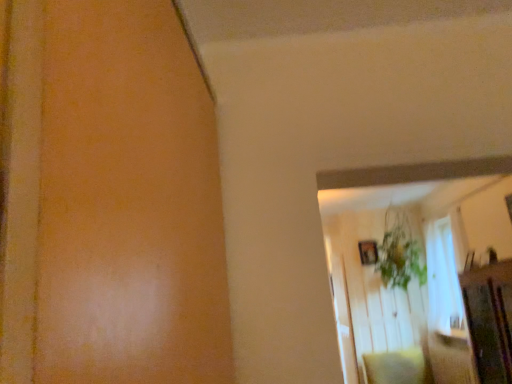
Question: Is soft beige pillow at lower right smaller than green leafy plant at upper center?

Choices:
 (A) no
 (B) yes

Answer: (B)

Question: From the image's perspective, is soft beige pillow at lower right located beneath green leafy plant at upper center?

Choices:
 (A) yes
 (B) no

Answer: (A)

Question: Is soft beige pillow at lower right to the left of green leafy plant at upper center from the viewer's perspective?

Choices:
 (A) no
 (B) yes

Answer: (B)

Question: From a real-world perspective, does soft beige pillow at lower right stand above green leafy plant at upper center?

Choices:
 (A) yes
 (B) no

Answer: (B)

Question: Does soft beige pillow at lower right lie behind green leafy plant at upper center?

Choices:
 (A) yes
 (B) no

Answer: (B)

Question: Considering the relative positions of soft beige pillow at lower right and green leafy plant at upper center in the image provided, is soft beige pillow at lower right to the right of green leafy plant at upper center from the viewer's perspective?

Choices:
 (A) no
 (B) yes

Answer: (A)

Question: Is soft beige pillow at lower right closer to camera compared to wooden picture frame at upper right?

Choices:
 (A) no
 (B) yes

Answer: (B)

Question: From a real-world perspective, does soft beige pillow at lower right sit lower than wooden picture frame at upper right?

Choices:
 (A) no
 (B) yes

Answer: (B)

Question: Considering the relative positions of soft beige pillow at lower right and wooden picture frame at upper right in the image provided, is soft beige pillow at lower right behind wooden picture frame at upper right?

Choices:
 (A) yes
 (B) no

Answer: (B)

Question: Can you confirm if soft beige pillow at lower right is thinner than wooden picture frame at upper right?

Choices:
 (A) no
 (B) yes

Answer: (A)

Question: Would you say soft beige pillow at lower right is a long distance from wooden picture frame at upper right?

Choices:
 (A) yes
 (B) no

Answer: (A)

Question: Does soft beige pillow at lower right have a larger size compared to wooden picture frame at upper right?

Choices:
 (A) no
 (B) yes

Answer: (B)

Question: Considering the relative sizes of wooden picture frame at upper right and green leafy plant at upper center in the image provided, is wooden picture frame at upper right smaller than green leafy plant at upper center?

Choices:
 (A) no
 (B) yes

Answer: (B)